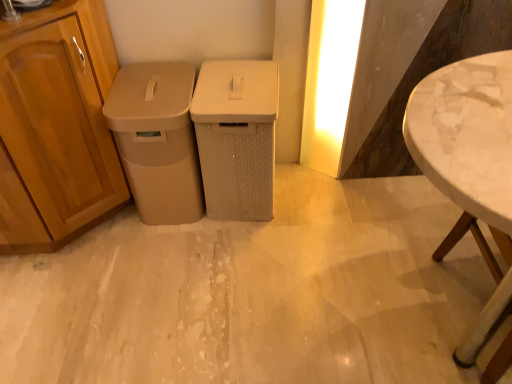
At what (x,y) coordinates should I click in order to perform the action: click on vacant space underneath white marble table at right (from a real-world perspective). Please return your answer as a coordinate pair (x, y). This screenshot has width=512, height=384. Looking at the image, I should click on (452, 294).